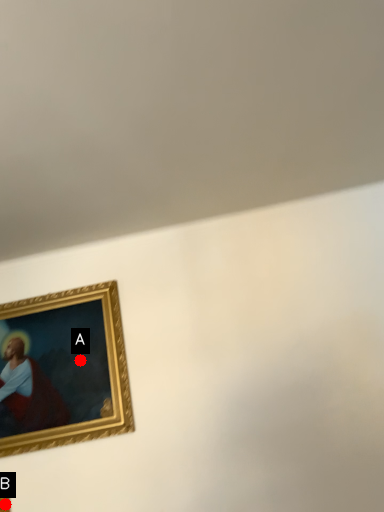
Question: Two points are circled on the image, labeled by A and B beside each circle. Which point is further to the camera?

Choices:
 (A) A is further
 (B) B is further

Answer: (A)